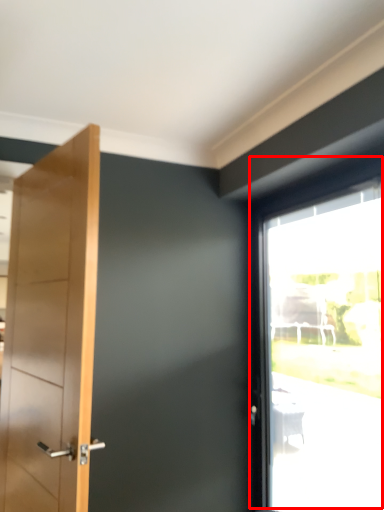
Question: Considering the relative positions of window (annotated by the red box) and door in the image provided, where is window (annotated by the red box) located with respect to the staircase?

Choices:
 (A) left
 (B) right

Answer: (B)